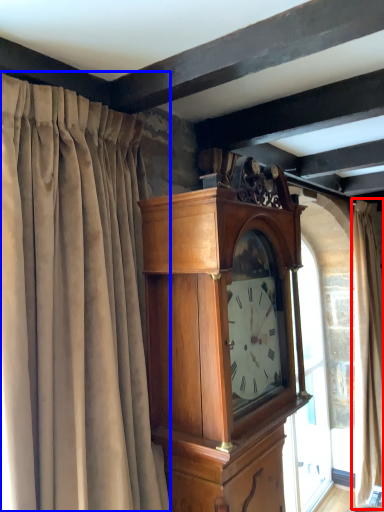
Question: Which object is closer to the camera taking this photo, curtain (highlighted by a red box) or curtain (highlighted by a blue box)?

Choices:
 (A) curtain
 (B) curtain

Answer: (B)